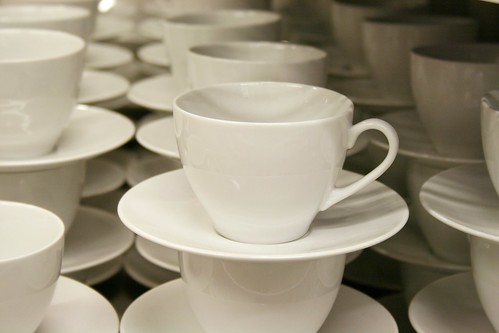
Where is `rim of cup`? This screenshot has width=499, height=333. rim of cup is located at coordinates (307, 130), (310, 59), (267, 22), (67, 47), (44, 252), (80, 24), (453, 66), (496, 112), (396, 30), (353, 9).